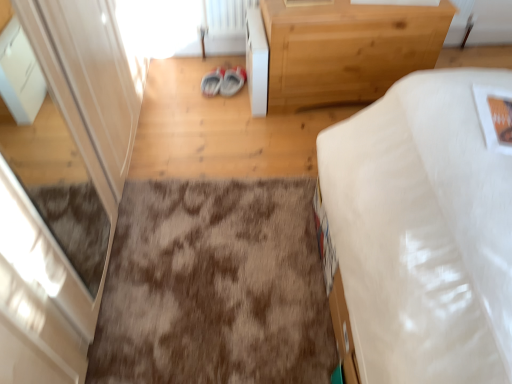
This screenshot has height=384, width=512. Find the location of `free space behind brown shaggy rug at center`. free space behind brown shaggy rug at center is located at coordinates (214, 134).